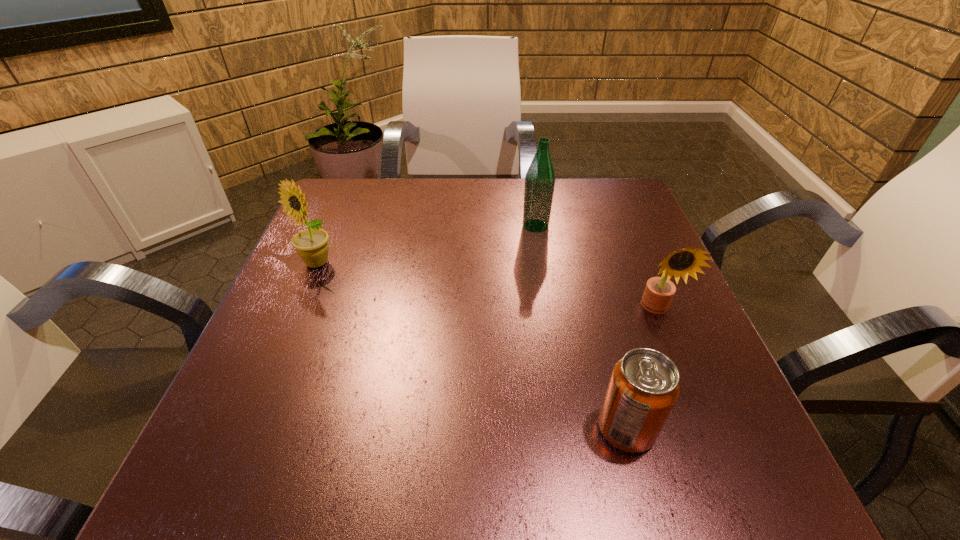
The height and width of the screenshot is (540, 960). In the image, there is a desktop. Find the location of `vacant region at the left edge`. vacant region at the left edge is located at coordinates (308, 293).

I want to click on free space at the right edge of the desktop, so click(x=656, y=349).

Where is `vacant space at the far left corner`? The height and width of the screenshot is (540, 960). vacant space at the far left corner is located at coordinates (338, 178).

Identify the location of vacant space at the near left corner. (300, 482).

The width and height of the screenshot is (960, 540). What are the coordinates of `free location at the far right corner of the desktop` in the screenshot? It's located at (592, 221).

Find the location of a particular element. The height and width of the screenshot is (540, 960). free point at the near right corner is located at coordinates (760, 471).

Where is `vacant area that lies between the nearest object and the third object from right to left`? This screenshot has height=540, width=960. vacant area that lies between the nearest object and the third object from right to left is located at coordinates (581, 327).

The height and width of the screenshot is (540, 960). I want to click on blank region between the third object from right to left and the farther sunflower, so click(x=426, y=245).

This screenshot has height=540, width=960. I want to click on free spot between the farthest object and the farther sunflower, so click(426, 245).

Find the location of a particular element. Image resolution: width=960 pixels, height=540 pixels. free area in between the farthest object and the second farthest object is located at coordinates (426, 245).